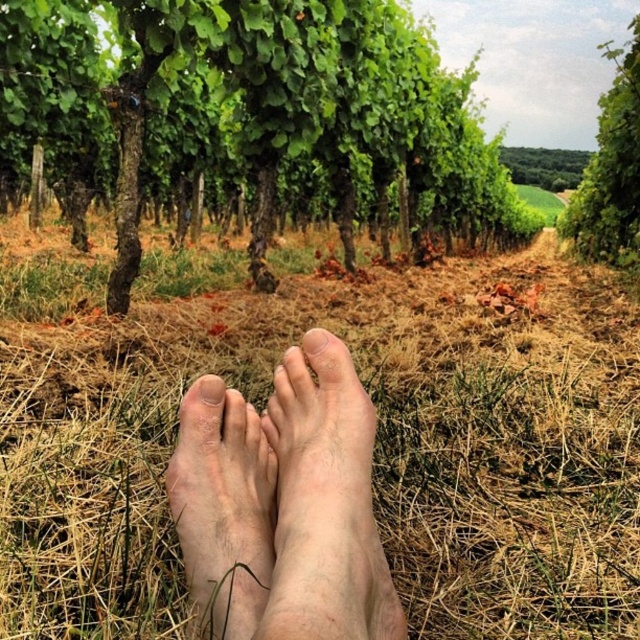
Question: Can you confirm if green leafy tree at upper right is positioned below pink flesh at center?

Choices:
 (A) yes
 (B) no

Answer: (B)

Question: Which point is farther to the camera?

Choices:
 (A) (612, 193)
 (B) (424, 28)
 (C) (577, 160)
 (D) (296, 452)

Answer: (C)

Question: Does pale skin barefoot at center have a smaller size compared to dry skin foot at center?

Choices:
 (A) yes
 (B) no

Answer: (B)

Question: Does dry skin foot at center come in front of green leafy tree at upper center?

Choices:
 (A) yes
 (B) no

Answer: (A)

Question: Which object is the closest to the dry grass at center?

Choices:
 (A) green leafy tree at upper right
 (B) pale skin toe at center

Answer: (B)

Question: Which of these objects is positioned closest to the green leafy tree at upper center?

Choices:
 (A) green leafy tree at center
 (B) pale skin barefoot at center
 (C) dry skin foot at center

Answer: (A)